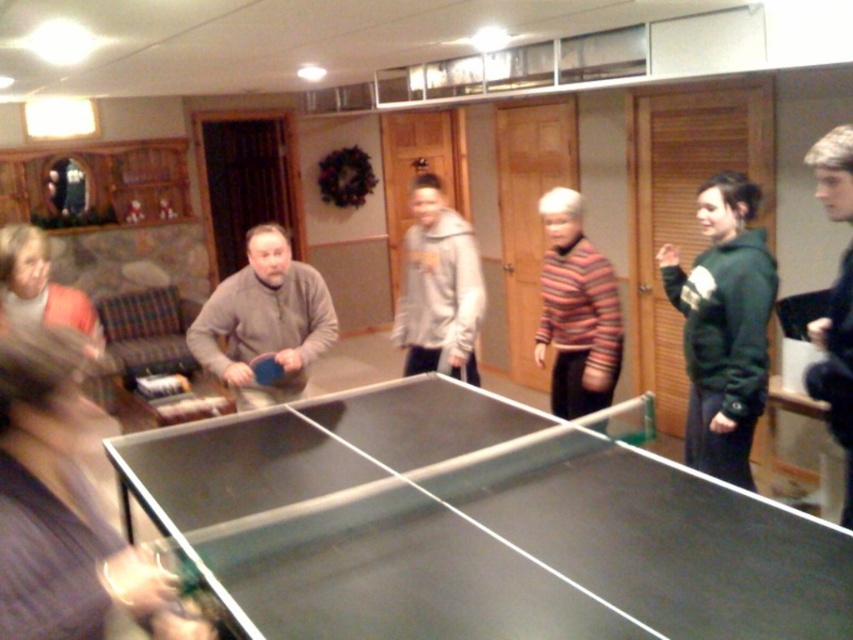
You are a guest at a housewarming party and see the smooth black table at center and the striped sweater at center. Which object is taller from your perspective?

The striped sweater at center is taller than the smooth black table at center.

You are a photographer setting up a shoot in this room. You need to ensure that the dark gray fabric shirt at lower left and the striped sweater at center are both visible in the frame. Given their sizes, which one might require more space in the composition to avoid being cropped?

The striped sweater at center requires more space in the composition because its width is greater than the dark gray fabric shirt at lower left, so it needs to be positioned carefully to avoid cropping.

Looking at this image, where is the striped sweater at center located in the image?

The striped sweater at center is located at point (576, 310).